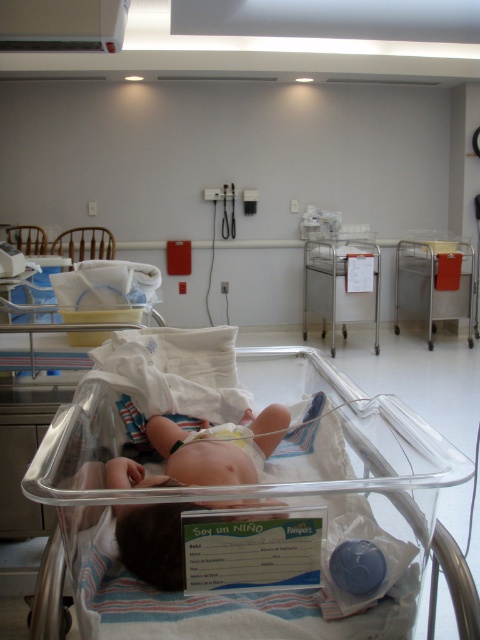
Who is taller, metallic cart at center or white soft diaper at center?

With more height is metallic cart at center.

How much distance is there between metallic cart at center and white soft diaper at center?

metallic cart at center is 4.03 meters from white soft diaper at center.

Is point (337, 246) positioned in front of point (237, 444)?

No, (337, 246) is further to viewer.

Where is `metallic cart at center`? This screenshot has width=480, height=640. metallic cart at center is located at coordinates (342, 284).

How much distance is there between clear plastic infant bed at center and metallic cart at center?

clear plastic infant bed at center is 3.83 meters from metallic cart at center.

Between point (278, 371) and point (302, 321), which one is positioned in front?

Positioned in front is point (278, 371).

In order to click on clear plastic infant bed at center in this screenshot , I will do `click(238, 499)`.

Between metallic cart at right and white soft diaper at center, which one is positioned higher?

Positioned higher is metallic cart at right.

Measure the distance between metallic cart at right and camera.

The distance of metallic cart at right from camera is 5.10 meters.

Image resolution: width=480 pixels, height=640 pixels. What do you see at coordinates (434, 284) in the screenshot?
I see `metallic cart at right` at bounding box center [434, 284].

I want to click on metallic cart at right, so click(x=434, y=284).